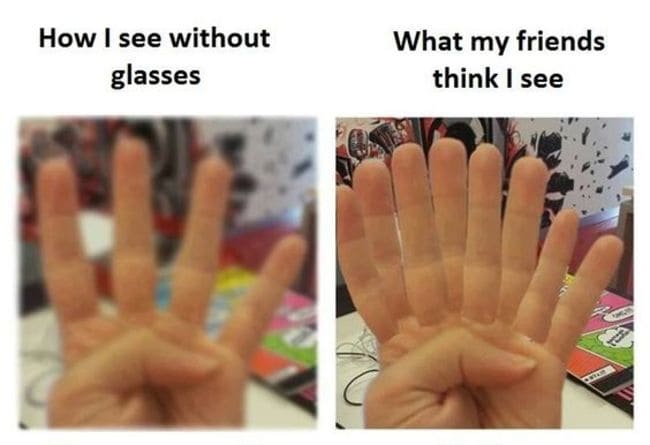
Identify the location of cords. (361, 346).